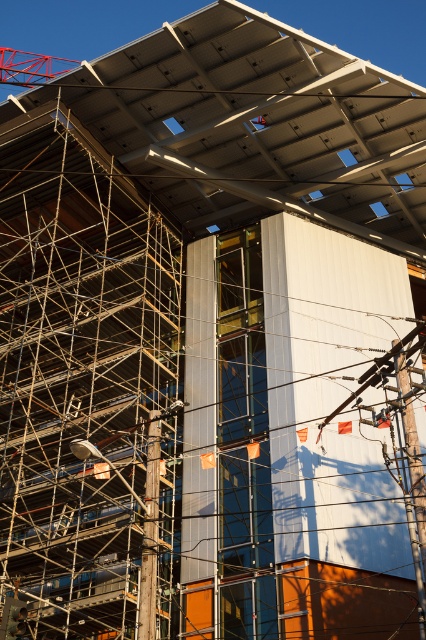
Question: Which of the following is the closest to the observer?

Choices:
 (A) metallic red crane at upper left
 (B) metallic scaffolding at left

Answer: (B)

Question: Among these objects, which one is farthest from the camera?

Choices:
 (A) metallic red crane at upper left
 (B) metallic scaffolding at left

Answer: (A)

Question: Does metallic scaffolding at left appear under metallic red crane at upper left?

Choices:
 (A) no
 (B) yes

Answer: (B)

Question: Does metallic scaffolding at left appear under metallic red crane at upper left?

Choices:
 (A) yes
 (B) no

Answer: (A)

Question: Which point is closer to the camera?

Choices:
 (A) metallic scaffolding at left
 (B) metallic red crane at upper left

Answer: (A)

Question: Is metallic scaffolding at left above metallic red crane at upper left?

Choices:
 (A) yes
 (B) no

Answer: (B)